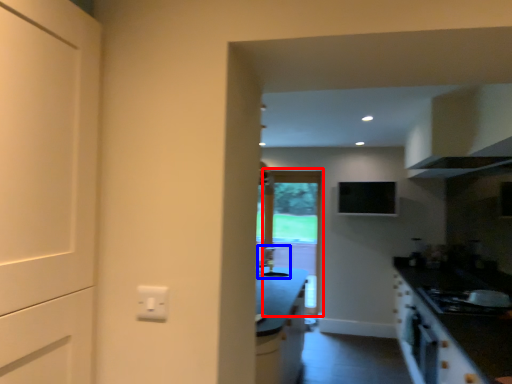
Question: Which of the following is the farthest to the observer, screen door (highlighted by a red box) or sink (highlighted by a blue box)?

Choices:
 (A) screen door
 (B) sink

Answer: (A)